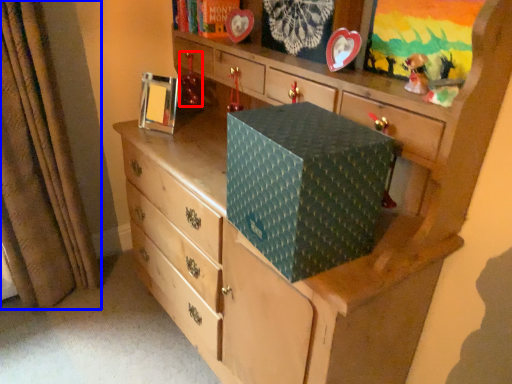
Question: Which object appears closest to the camera in this image, toy (highlighted by a red box) or curtain (highlighted by a blue box)?

Choices:
 (A) toy
 (B) curtain

Answer: (B)